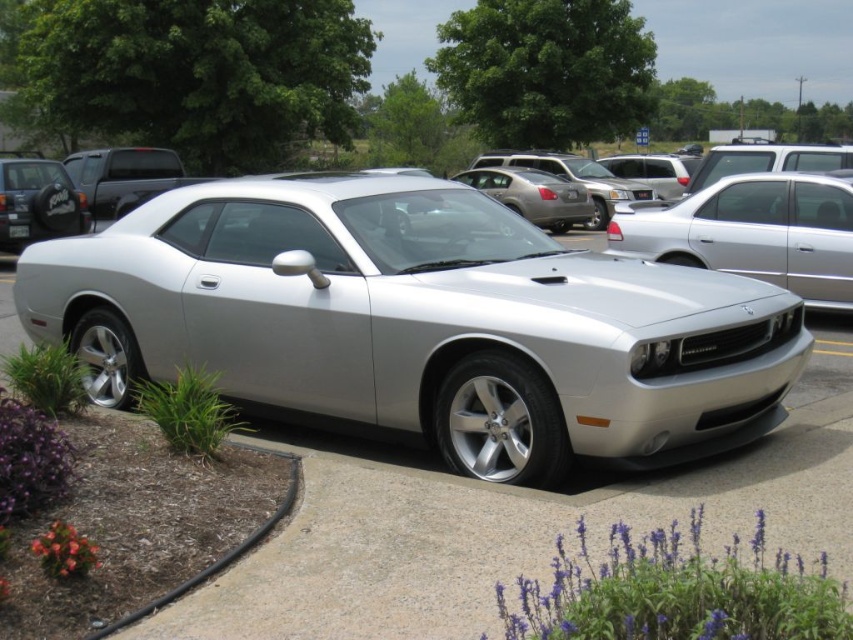
Looking at this image, you are a photographer trying to capture the silver metallic sports car at center and the satin silver car at center. Which car should you focus on first if you want to photograph the one closer to the ground?

The silver metallic sports car at center is below the satin silver car at center, so you should focus on the silver metallic sports car at center first because it is closer to the ground.

You are a customer at a car dealership and want to find the silver metallic sports car at center. Based on the scene description, where would you look relative to the satin black truck at upper left?

The silver metallic sports car at center is located to the right of the satin black truck at upper left, so you should look towards the right side of the truck to find it.